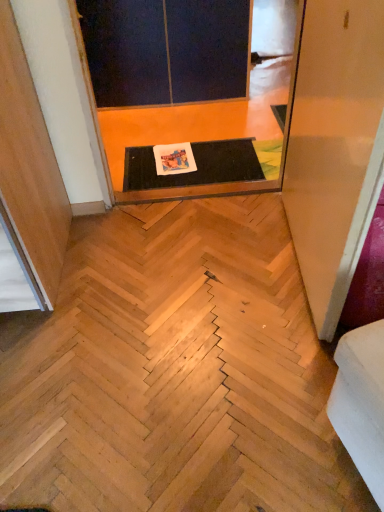
Question: From the image's perspective, is dark matte screen door at upper center, arranged as the first screen door when viewed from the back, above white fabric couch at lower right?

Choices:
 (A) yes
 (B) no

Answer: (A)

Question: Considering the relative sizes of dark matte screen door at upper center, acting as the third screen door starting from the front, and white fabric couch at lower right in the image provided, is dark matte screen door at upper center, acting as the third screen door starting from the front, thinner than white fabric couch at lower right?

Choices:
 (A) no
 (B) yes

Answer: (A)

Question: Considering the relative sizes of dark matte screen door at upper center, acting as the third screen door starting from the front, and white fabric couch at lower right in the image provided, is dark matte screen door at upper center, acting as the third screen door starting from the front, smaller than white fabric couch at lower right?

Choices:
 (A) no
 (B) yes

Answer: (A)

Question: Is dark matte screen door at upper center, arranged as the first screen door when viewed from the back, turned away from white fabric couch at lower right?

Choices:
 (A) no
 (B) yes

Answer: (A)

Question: Does dark matte screen door at upper center, acting as the third screen door starting from the front, have a larger size compared to white fabric couch at lower right?

Choices:
 (A) yes
 (B) no

Answer: (A)

Question: Is point (294, 48) closer or farther from the camera than point (362, 141)?

Choices:
 (A) closer
 (B) farther

Answer: (B)

Question: In terms of width, does black rubber mat at center, which ranks as the second screen door in front-to-back order, look wider or thinner when compared to transparent plastic screen door at upper right, the first screen door when ordered from front to back?

Choices:
 (A) thin
 (B) wide

Answer: (B)

Question: From the image's perspective, is black rubber mat at center, which ranks as the second screen door in front-to-back order, positioned above or below transparent plastic screen door at upper right, the first screen door when ordered from front to back?

Choices:
 (A) below
 (B) above

Answer: (B)

Question: Which is correct: black rubber mat at center, which ranks as the second screen door in front-to-back order, is inside transparent plastic screen door at upper right, the first screen door when ordered from front to back, or outside of it?

Choices:
 (A) inside
 (B) outside

Answer: (B)

Question: Is white fabric couch at lower right taller or shorter than dark matte screen door at upper center, acting as the third screen door starting from the front?

Choices:
 (A) short
 (B) tall

Answer: (A)

Question: Considering the positions of white fabric couch at lower right and dark matte screen door at upper center, arranged as the first screen door when viewed from the back, in the image, is white fabric couch at lower right wider or thinner than dark matte screen door at upper center, arranged as the first screen door when viewed from the back,?

Choices:
 (A) thin
 (B) wide

Answer: (A)

Question: Is white fabric couch at lower right inside the boundaries of dark matte screen door at upper center, arranged as the first screen door when viewed from the back, or outside?

Choices:
 (A) outside
 (B) inside

Answer: (A)

Question: Is white fabric couch at lower right in front of or behind dark matte screen door at upper center, arranged as the first screen door when viewed from the back, in the image?

Choices:
 (A) behind
 (B) front

Answer: (B)

Question: Is black rubber mat at center, which appears as the second screen door when viewed from the back, taller or shorter than dark matte screen door at upper center, acting as the third screen door starting from the front?

Choices:
 (A) short
 (B) tall

Answer: (A)

Question: Is black rubber mat at center, which ranks as the second screen door in front-to-back order, to the left or to the right of dark matte screen door at upper center, arranged as the first screen door when viewed from the back, in the image?

Choices:
 (A) left
 (B) right

Answer: (B)